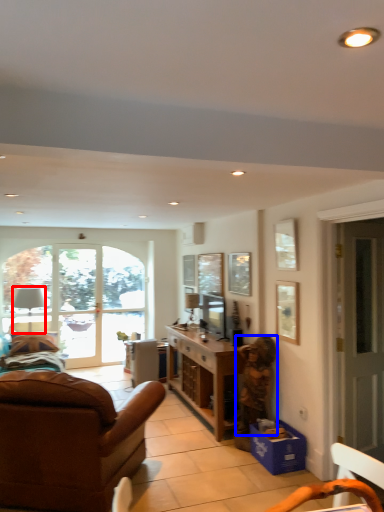
Question: Among these objects, which one is nearest to the camera, lamp (highlighted by a red box) or person (highlighted by a blue box)?

Choices:
 (A) lamp
 (B) person

Answer: (B)